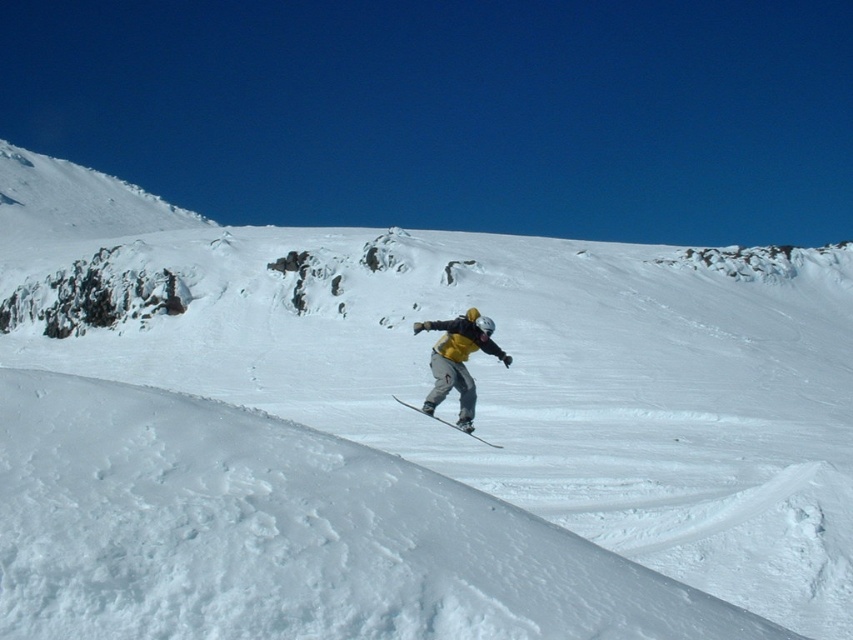
Question: Does yellow fabric snowboarder at center have a greater width compared to metallic gray ski at center?

Choices:
 (A) no
 (B) yes

Answer: (B)

Question: Which point appears closest to the camera in this image?

Choices:
 (A) (497, 445)
 (B) (490, 349)

Answer: (B)

Question: Which object appears farthest from the camera in this image?

Choices:
 (A) metallic gray ski at center
 (B) yellow fabric snowboarder at center

Answer: (A)

Question: Does yellow fabric snowboarder at center have a larger size compared to metallic gray ski at center?

Choices:
 (A) yes
 (B) no

Answer: (A)

Question: Is the position of yellow fabric snowboarder at center more distant than that of metallic gray ski at center?

Choices:
 (A) no
 (B) yes

Answer: (A)